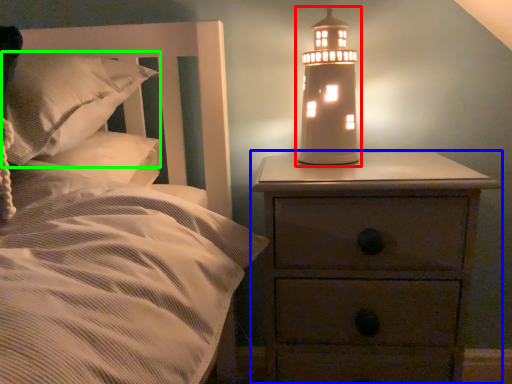
Question: Which is nearer to the oil lamp (highlighted by a red box)? nightstand (highlighted by a blue box) or pillow (highlighted by a green box).

Choices:
 (A) nightstand
 (B) pillow

Answer: (A)